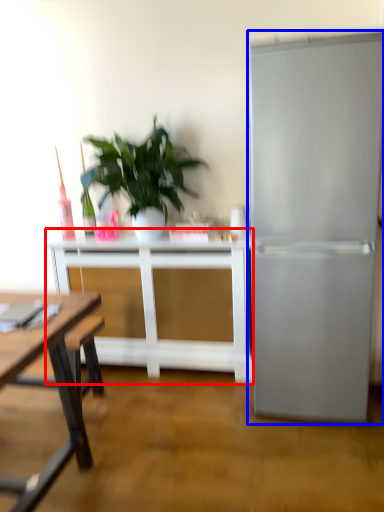
Question: Among these objects, which one is farthest to the camera, table (highlighted by a red box) or refrigerator (highlighted by a blue box)?

Choices:
 (A) table
 (B) refrigerator

Answer: (A)